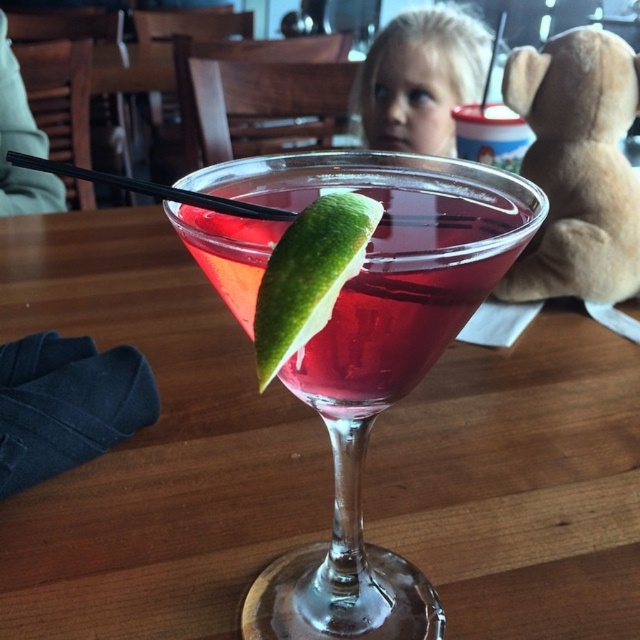
Question: Does translucent glass drink at center appear under green matte lime at center?

Choices:
 (A) no
 (B) yes

Answer: (A)

Question: Can you confirm if translucent glass martini at center is positioned above green matte lime at center?

Choices:
 (A) yes
 (B) no

Answer: (B)

Question: Which object is closer to the camera taking this photo?

Choices:
 (A) green matte lime at center
 (B) translucent glass martini at center

Answer: (A)

Question: Which object appears closest to the camera in this image?

Choices:
 (A) translucent glass martini at center
 (B) green matte lime at center
 (C) translucent glass drink at center

Answer: (B)

Question: Is translucent glass martini at center closer to the viewer compared to translucent glass drink at center?

Choices:
 (A) no
 (B) yes

Answer: (B)

Question: Which point is closer to the camera?

Choices:
 (A) (305, 209)
 (B) (512, 248)
 (C) (282, 372)

Answer: (A)